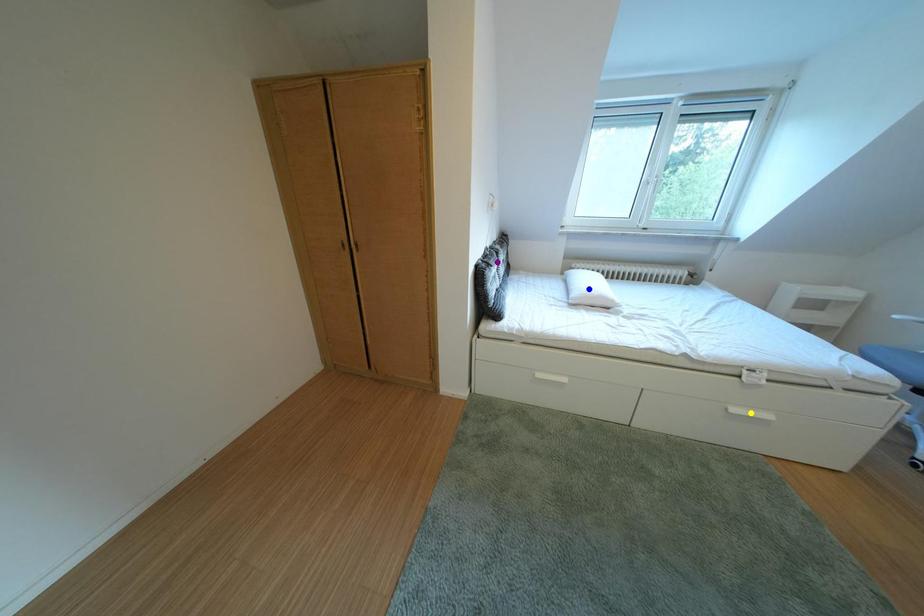
Order these from nearest to farthest:
1. purple point
2. yellow point
3. blue point

yellow point → purple point → blue point